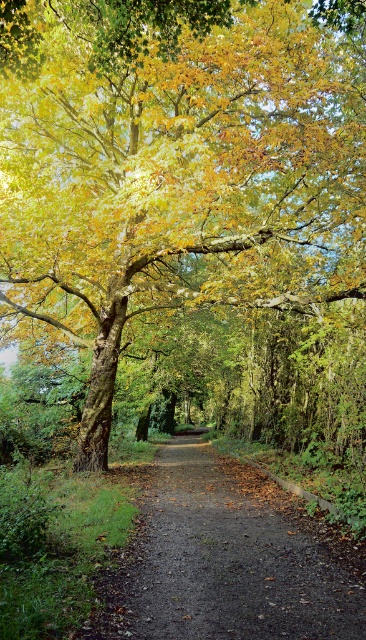
Is the position of golden leafy tree at center more distant than that of dirt path at center?

That is True.

Is golden leafy tree at center bigger than dirt path at center?

Yes.

Image resolution: width=366 pixels, height=640 pixels. Find the location of `golden leafy tree at center`. golden leafy tree at center is located at coordinates (192, 211).